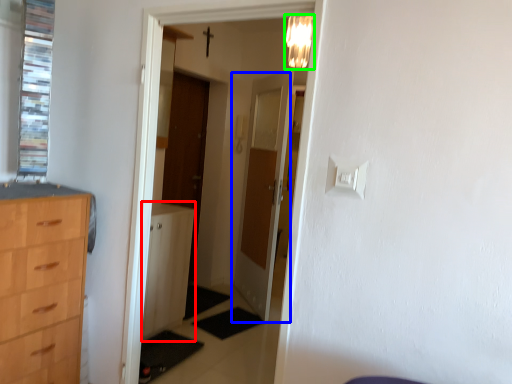
Question: Which is nearer to the file cabinet (highlighted by a red box)? door (highlighted by a blue box) or light fixture (highlighted by a green box).

Choices:
 (A) door
 (B) light fixture

Answer: (A)